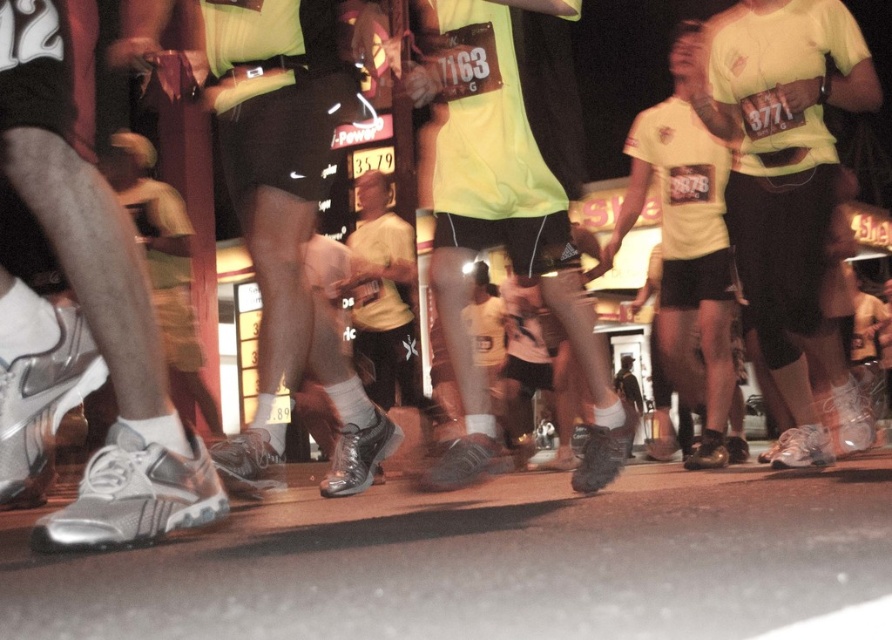
Consider the image. You are a photographer standing at the center of the image. You want to capture a closeup of the silver metallic shoe at lower left. Based on its 2D location coordinates, which direction should you move to get closer to it?

The silver metallic shoe at lower left is located at coordinates point (85, 301), so you should move to the left and downward to get closer to it.

You are a photographer standing behind the runners. You want to capture a photo that includes both the silver metallic shoe at lower left and the yellow matte shirt at center. Given that your camera has a maximum focus range of 10 feet, will you be able to fit both objects in the frame without moving closer?

The distance between the silver metallic shoe at lower left and the yellow matte shirt at center is 12.08 feet. Since the camera can only focus up to 10 feet, the objects are too far apart to be captured clearly in the same frame without moving closer.

In the scene shown: You are a photographer capturing the runners in this scene. You want to focus on the point that is closer to the camera. Which point should you choose between point (786, 364) and point (456, 342)?

Point (456, 342) is closer to the camera than point (786, 364), so you should choose point (456, 342) to focus on the closer point.